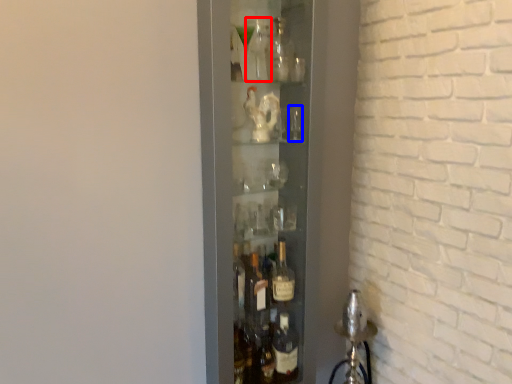
Question: Among these objects, which one is nearest to the camera, bottle (highlighted by a red box) or shot glass (highlighted by a blue box)?

Choices:
 (A) bottle
 (B) shot glass

Answer: (A)